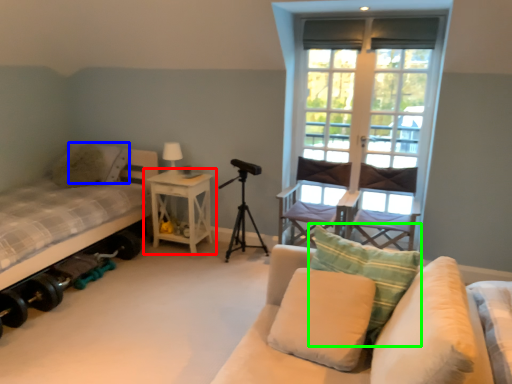
Question: Which is nearer to the nightstand (highlighted by a red box)? pillow (highlighted by a blue box) or pillow (highlighted by a green box).

Choices:
 (A) pillow
 (B) pillow

Answer: (A)